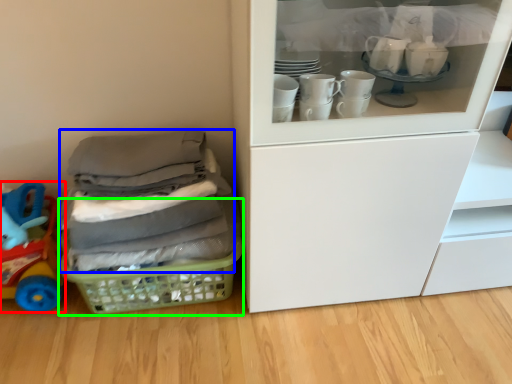
Question: Based on their relative distances, which object is nearer to toy (highlighted by a red box)? Choose from clothing (highlighted by a blue box) and basket (highlighted by a green box).

Choices:
 (A) clothing
 (B) basket

Answer: (B)